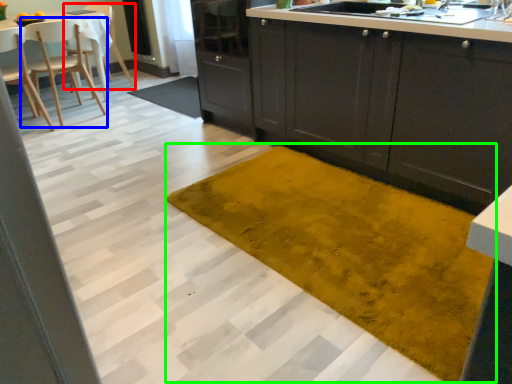
Question: Based on their relative distances, which object is farther from chair (highlighted by a red box)? Choose from chair (highlighted by a blue box) and doormat (highlighted by a green box).

Choices:
 (A) chair
 (B) doormat

Answer: (B)